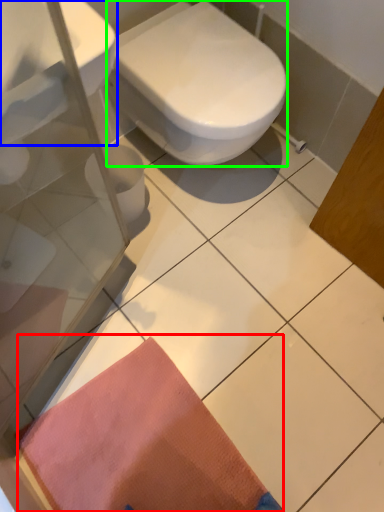
Question: Which object is the farthest from doormat (highlighted by a red box)? Choose among these: sink (highlighted by a blue box) or bidet (highlighted by a green box).

Choices:
 (A) sink
 (B) bidet

Answer: (A)